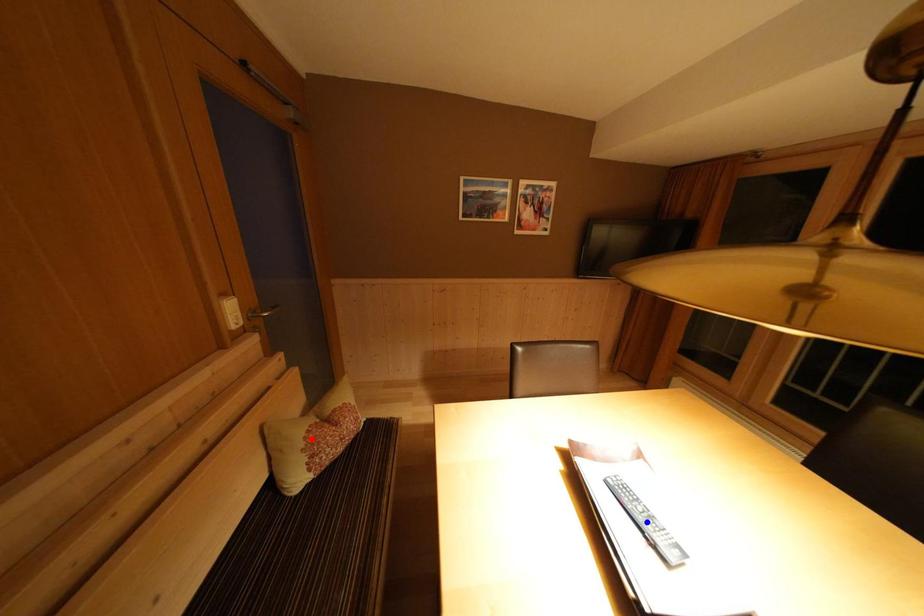
Question: Which of the two points in the image is closer to the camera?

Choices:
 (A) Blue point is closer.
 (B) Red point is closer.

Answer: (A)